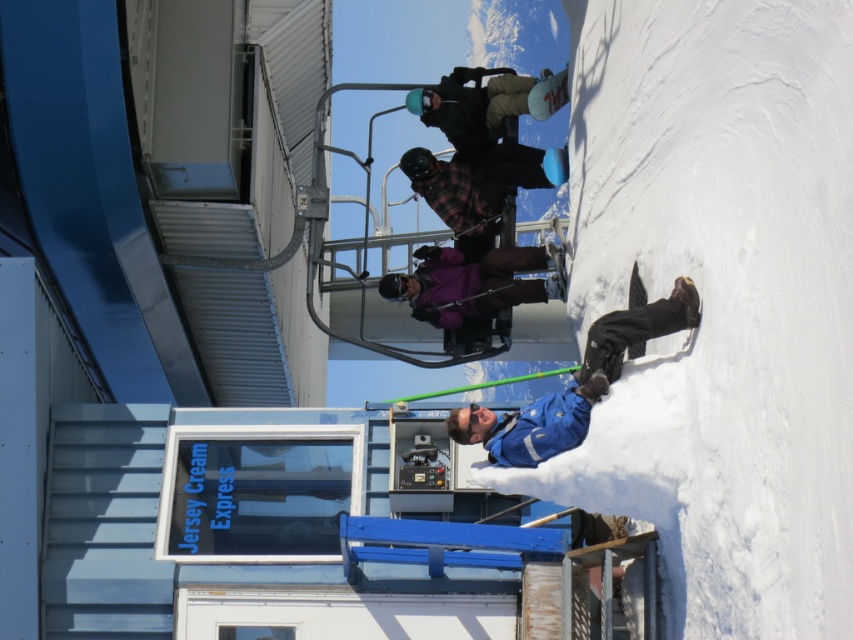
You are a photographer trying to capture the plaid fabric shirt at center in the image. According to the coordinates provided, where should you focus your camera to ensure the shirt is in the frame?

The plaid fabric shirt at center is located at point coordinates [480,186], so focusing your camera there will ensure it is in the frame.

You are a drone operator trying to capture a photo of the purple matte jacket at center from above. The drone has a camera with a 50mm lens. According to the coordinates given, where should you position the drone to ensure the jacket is centered in the photo?

The purple matte jacket at center is located at coordinates point [474,282], so the drone should be positioned directly above this point to center the jacket in the photo.